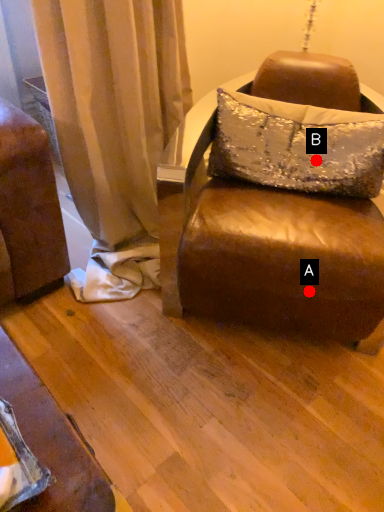
Question: Two points are circled on the image, labeled by A and B beside each circle. Which point appears closest to the camera in this image?

Choices:
 (A) A is closer
 (B) B is closer

Answer: (A)